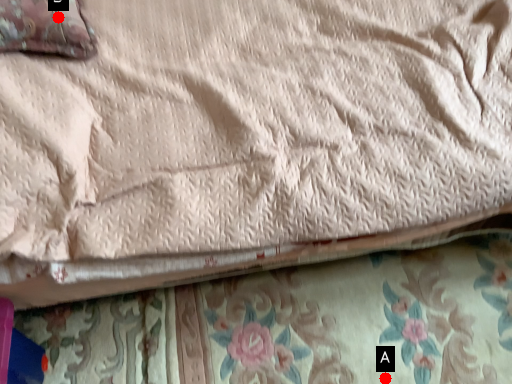
Question: Two points are circled on the image, labeled by A and B beside each circle. Which point is closer to the camera taking this photo?

Choices:
 (A) A is closer
 (B) B is closer

Answer: (B)